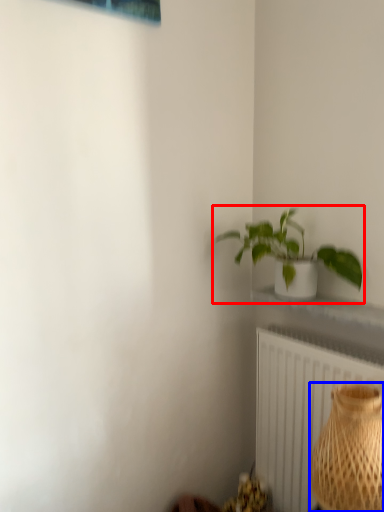
Question: Which of the following is the farthest to the observer, houseplant (highlighted by a red box) or vase (highlighted by a blue box)?

Choices:
 (A) houseplant
 (B) vase

Answer: (A)